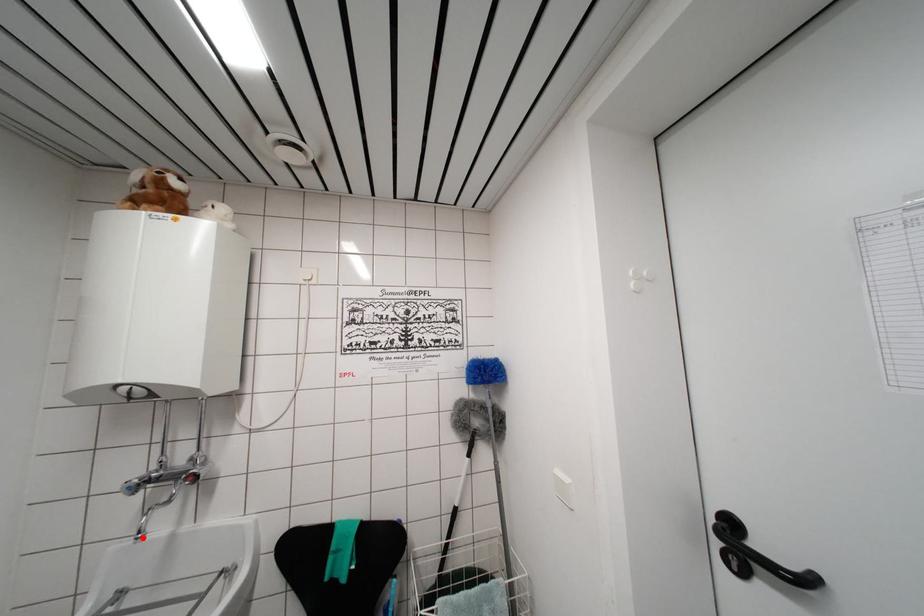
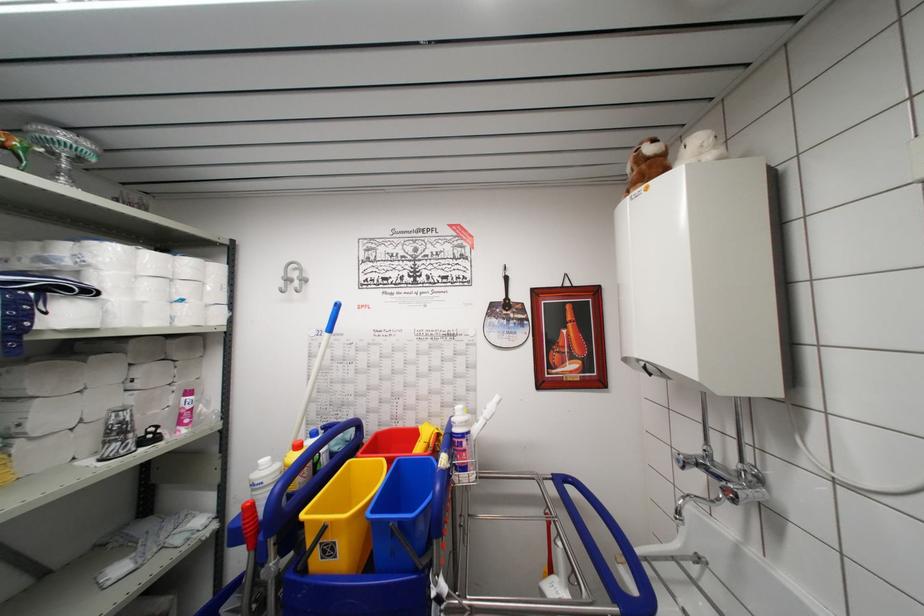
Question: I am providing you with two images of the same scene from different viewpoints. A red point is marked on the first image. Is the red point's position out of view in image 2?

Choices:
 (A) Yes
 (B) No

Answer: (B)